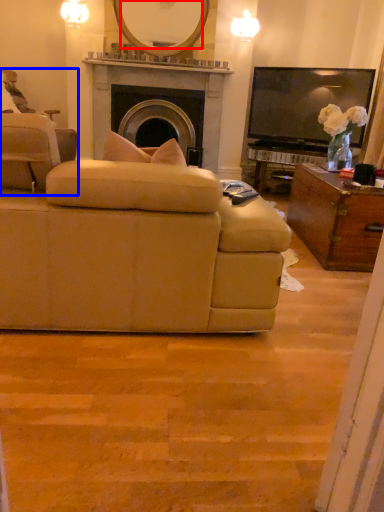
Question: Among these objects, which one is nearest to the camera, mirror (highlighted by a red box) or chair (highlighted by a blue box)?

Choices:
 (A) mirror
 (B) chair

Answer: (B)